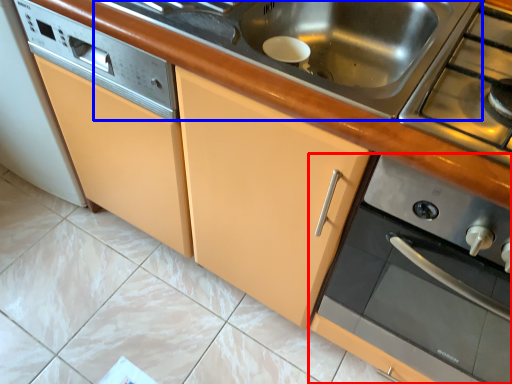
Question: Which point is closer to the camera, home appliance (highlighted by a red box) or sink (highlighted by a blue box)?

Choices:
 (A) home appliance
 (B) sink

Answer: (A)